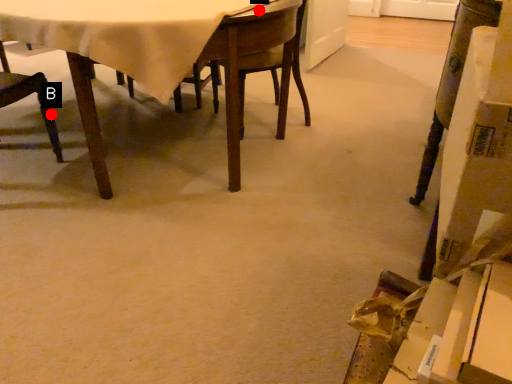
Question: Two points are circled on the image, labeled by A and B beside each circle. Which of the following is the closest to the observer?

Choices:
 (A) A is closer
 (B) B is closer

Answer: (A)